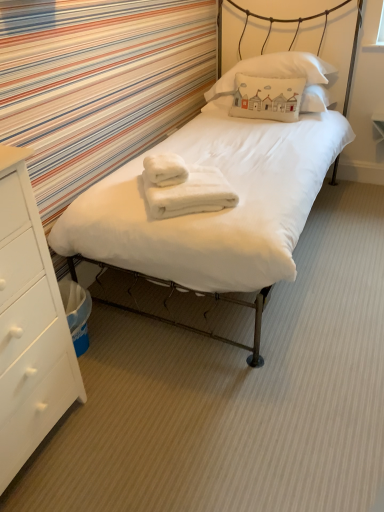
Where is `vacant area that lies to the right of white wood chest of drawers at lower left`? The image size is (384, 512). vacant area that lies to the right of white wood chest of drawers at lower left is located at coordinates (131, 422).